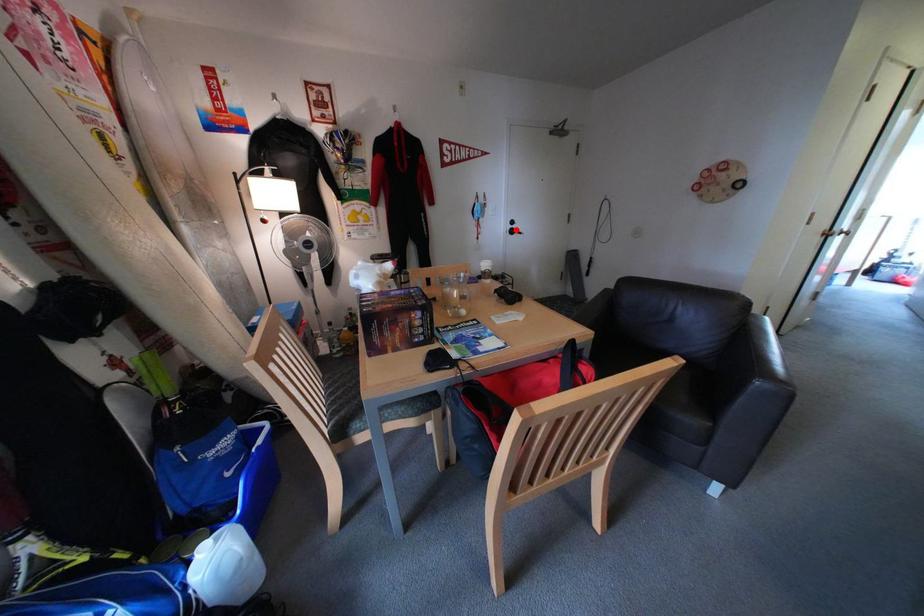
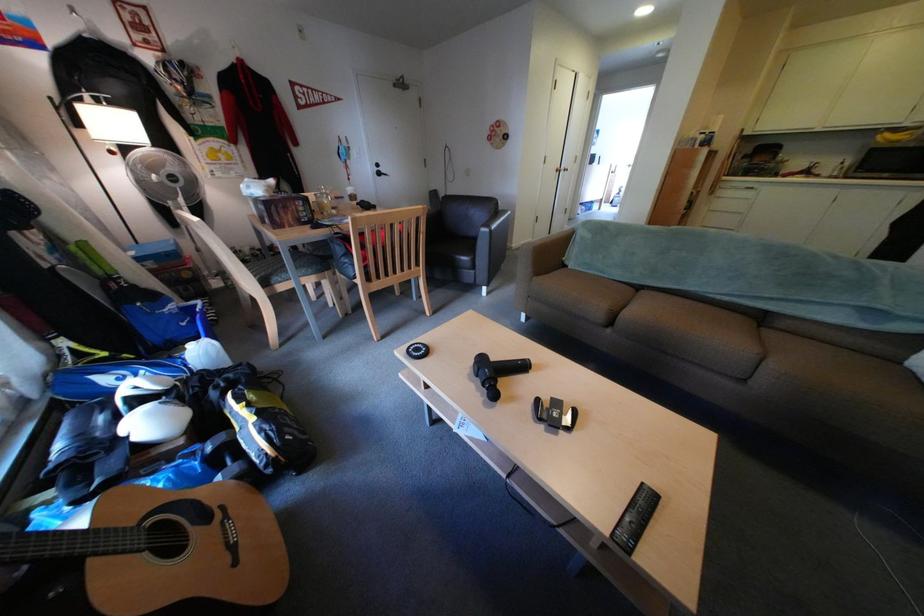
Find the pixel in the second image that matches the highlighted location in the first image.

(383, 172)